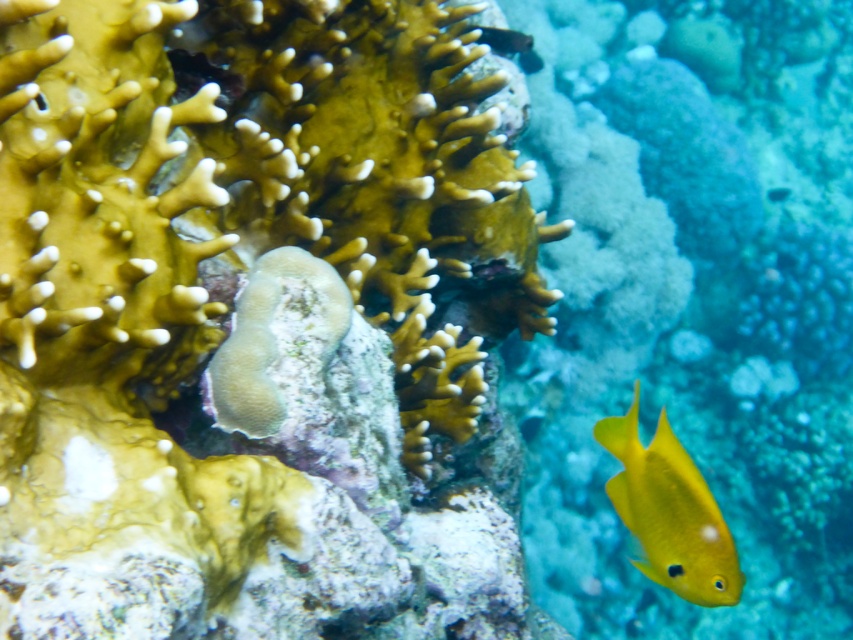
You are a marine biologist observing an underwater scene. You notice a smooth yellow coral at center and a yellow matte fish at right. Which object is larger in size?

The smooth yellow coral at center is bigger than the yellow matte fish at right.

You are a marine biologist observing an underwater scene. You notice the smooth yellow coral at center and the yellow matte fish at right. Which object is closer to you, the observer?

The smooth yellow coral at center is closer to you because it is positioned in front of the yellow matte fish at right.